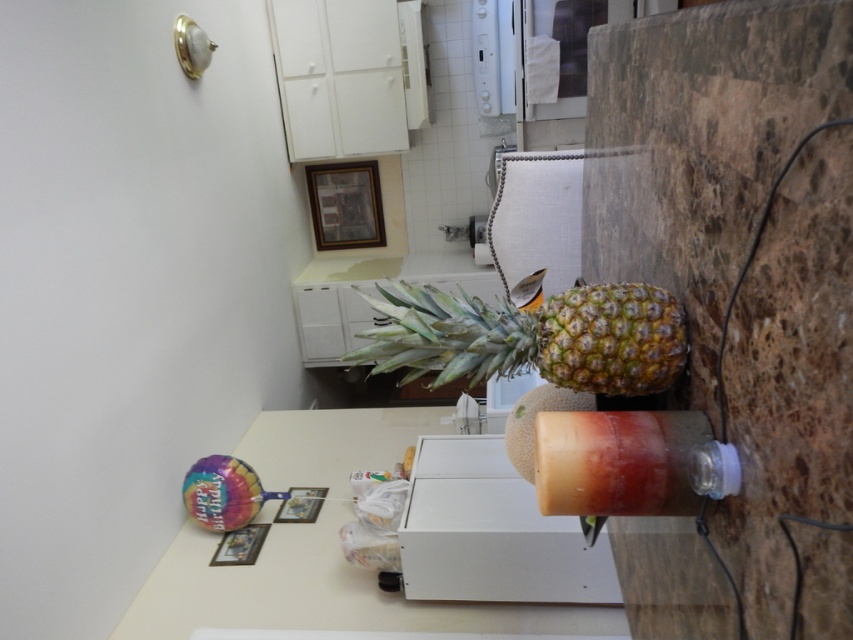
You are setting up a small table for a juice bar in the kitchen. You have a white matte table at center and a translucent plastic bottle at lower right. Which object should you place first if you want to ensure there is enough space for both?

The white matte table at center should be placed first because its width is larger than the translucent plastic bottle at lower right, ensuring there is enough space for both.

You are standing in the kitchen and want to place a 5.5 feet long board on the white matte table at center. Can the board fit on the table?

The white matte table at center is 6.02 feet away from camera, but the distance does not indicate the table size. The question about the board fitting cannot be answered with the provided information.